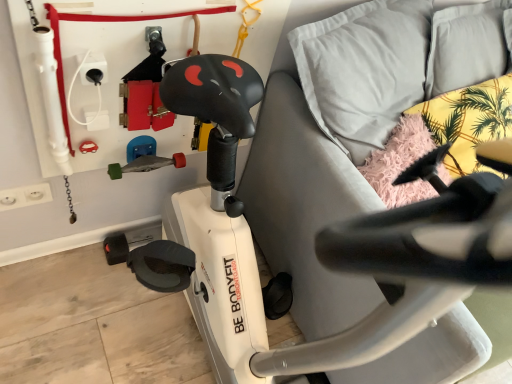
Describe the element at coordinates (468, 120) in the screenshot. Image resolution: width=512 pixels, height=384 pixels. I see `yellow fabric pillow at upper right` at that location.

Where is `yellow fabric pillow at upper right`? yellow fabric pillow at upper right is located at coordinates (468, 120).

Locate an element on the screen. Image resolution: width=512 pixels, height=384 pixels. yellow fabric pillow at upper right is located at coordinates (468, 120).